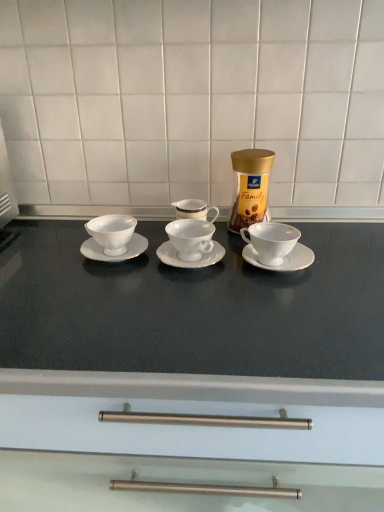
Identify the location of vacant space to the left of white porcelain saucer at center, marked as the 2th saucer in a right-to-left arrangement. (104, 269).